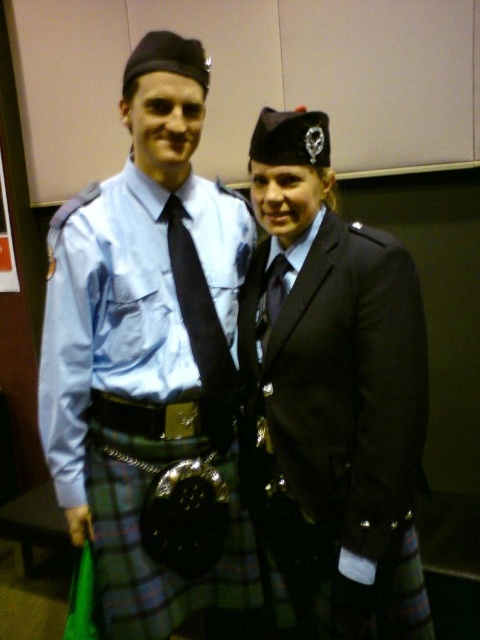
Is black satin kilt at center further to camera compared to matte black tie at center?

No, black satin kilt at center is closer to the viewer.

Is point (417, 472) closer to camera compared to point (265, 289)?

Yes, point (417, 472) is in front of point (265, 289).

Find the location of a particular element. black satin kilt at center is located at coordinates (337, 426).

Is matte blue shirt at center to the right of black silk tie at center from the viewer's perspective?

No, matte blue shirt at center is not to the right of black silk tie at center.

Is point (58, 483) farther from camera compared to point (168, 218)?

Yes, it is behind point (168, 218).

The width and height of the screenshot is (480, 640). Find the location of `matte blue shirt at center`. matte blue shirt at center is located at coordinates (146, 346).

From the picture: Does matte blue shirt at center appear under black satin kilt at center?

Incorrect, matte blue shirt at center is not positioned below black satin kilt at center.

Does matte blue shirt at center have a larger size compared to black satin kilt at center?

Yes.

Is point (72, 465) positioned in front of point (271, 401)?

No, it is behind (271, 401).

You are a GUI agent. You are given a task and a screenshot of the screen. Output one action in this format:
    pyautogui.click(x=<x>, y=<y>)
    Task: Click on the matte blue shirt at center
    Image resolution: width=480 pixels, height=640 pixels.
    Given the screenshot: What is the action you would take?
    pyautogui.click(x=146, y=346)